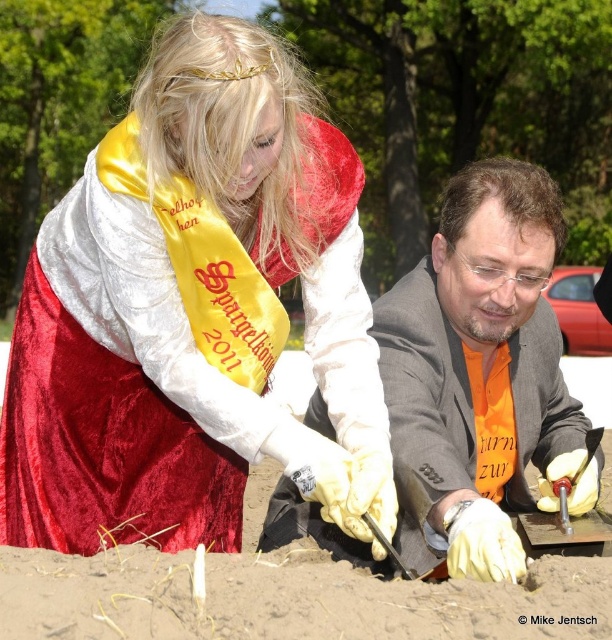
You are a photographer trying to capture the Spargelkoning 2011 ceremony. You notice the orange fabric suit at center and the brown sandy soil at lower center. Which object is closer to the right edge of the image?

The orange fabric suit at center is positioned on the right side of brown sandy soil at lower center, so it is closer to the right edge of the image.

You are a photographer standing 10 feet away from the orange fabric suit at center and the brown sandy soil at lower center. You want to capture both objects in a single photo without moving your position. Can you fit both objects in the frame if your camera has a 50mm lens? Explain your reasoning.

The orange fabric suit at center and brown sandy soil at lower center are 22.88 inches apart. With a 50mm lens at 10 feet distance, the field of view is approximately 16.6 feet wide. Since 22.88 inches is less than 16.6 feet, both objects can easily fit within the camera frame.